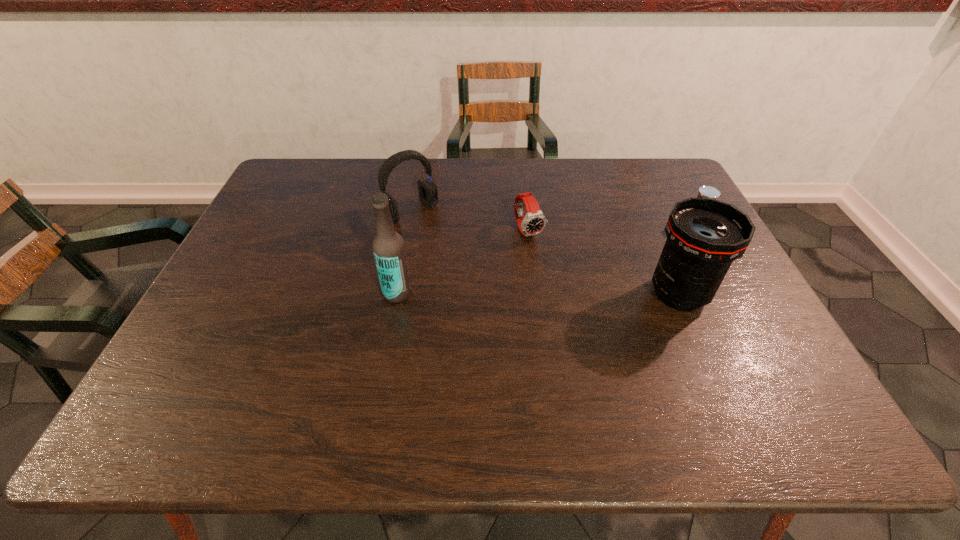
Locate an element on the screen. This screenshot has height=540, width=960. vacant region located on the label side of the jam is located at coordinates (598, 274).

Find the location of a particular element. The height and width of the screenshot is (540, 960). vacant space positioned on the label side of the jam is located at coordinates (607, 270).

Image resolution: width=960 pixels, height=540 pixels. Identify the location of vacant point located 0.210m on the face of the third object from right to left. (570, 295).

Locate an element on the screen. The height and width of the screenshot is (540, 960). free space located 0.080m on the face of the third object from right to left is located at coordinates (548, 262).

Where is `vacant space situated on the face of the third object from right to left`? Image resolution: width=960 pixels, height=540 pixels. vacant space situated on the face of the third object from right to left is located at coordinates (554, 272).

Identify the location of free location located on the headband of the third shortest object. (439, 237).

The width and height of the screenshot is (960, 540). In order to click on free region located 0.150m on the headband of the third shortest object in this screenshot , I will do [454, 252].

The image size is (960, 540). I want to click on vacant space located on the headband of the third shortest object, so click(487, 282).

The image size is (960, 540). Identify the location of object that is positioned at the far edge. (428, 190).

Where is `telephoto lens present at the right edge`? telephoto lens present at the right edge is located at coordinates (704, 236).